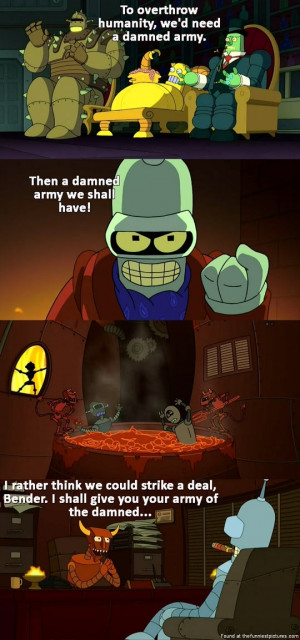
Identify the location of filing cabinet. The width and height of the screenshot is (300, 640). (15, 531), (13, 561).